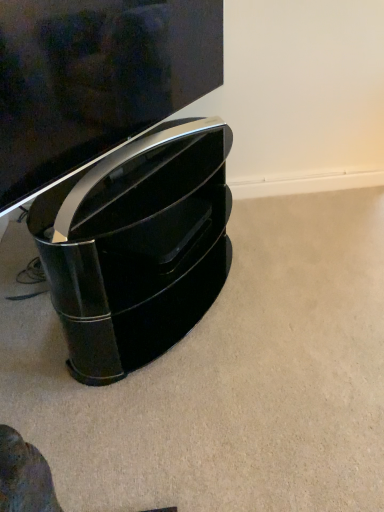
Identify the location of vacant space in glossy black tv at upper center (from a real-world perspective). (138, 170).